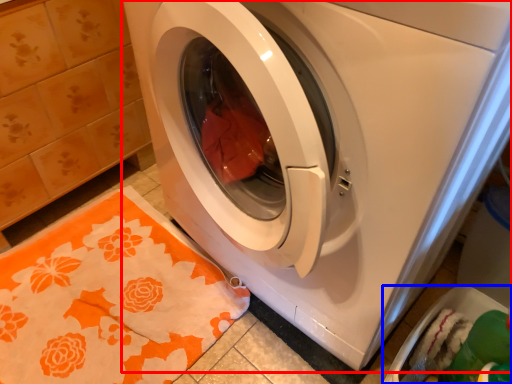
Question: Which of the following is the closest to the observer, washing machine (highlighted by a red box) or dish washer (highlighted by a blue box)?

Choices:
 (A) washing machine
 (B) dish washer

Answer: (A)